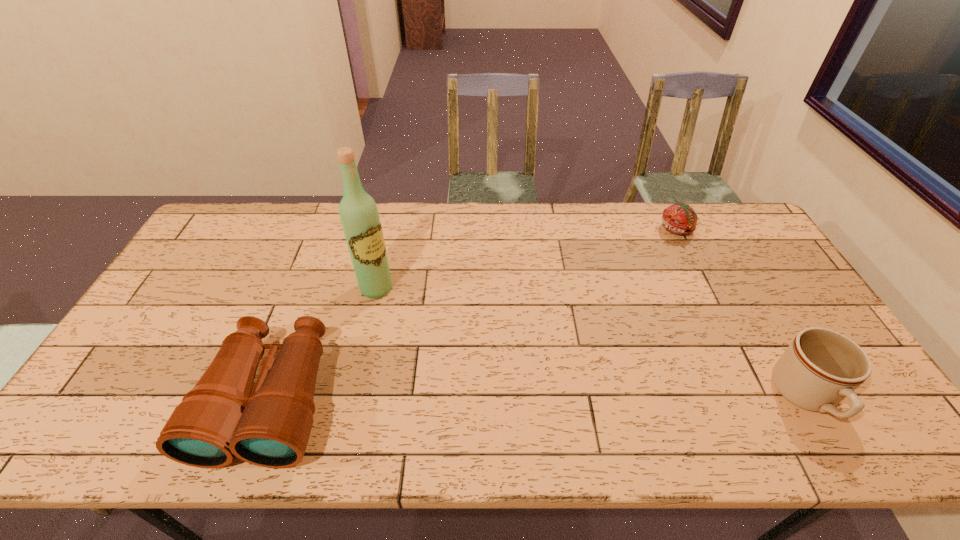
The width and height of the screenshot is (960, 540). Identify the location of vacant point located between the tallest object and the binoculars. (324, 344).

Select which object is the third closest to the binoculars. Please provide its 2D coordinates. Your answer should be formatted as a tuple, i.e. [(x, y)], where the tuple contains the x and y coordinates of a point satisfying the conditions above.

[(821, 367)]

The image size is (960, 540). What are the coordinates of `object that is the closest to the mug` in the screenshot? It's located at (680, 219).

The height and width of the screenshot is (540, 960). In order to click on free location that satisfies the following two spatial constraints: 1. on the back side of the farthest object; 2. on the right side of the third nearest object in this screenshot , I will do `click(390, 229)`.